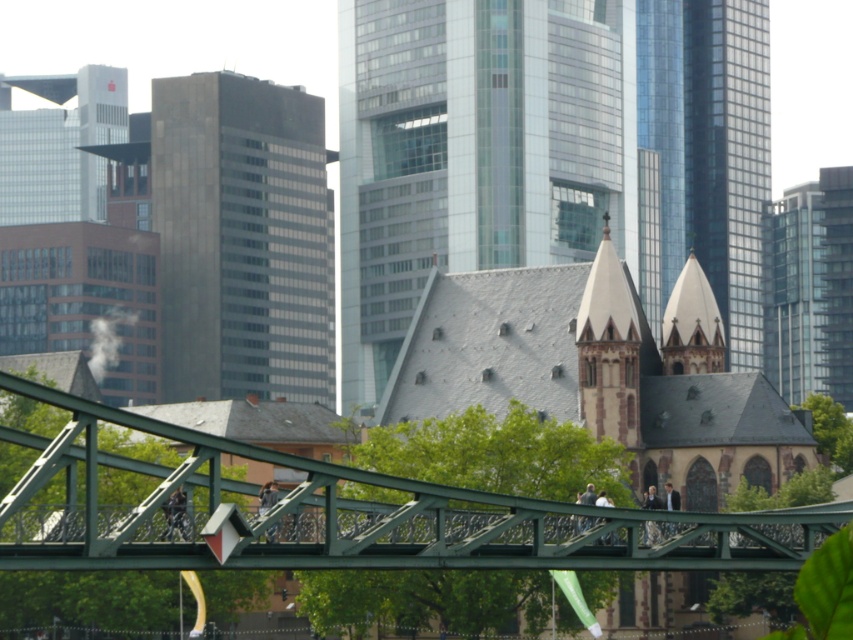
Question: Considering the real-world distances, which object is closest to the dark gray glass building at center?

Choices:
 (A) matte glass tower at upper left
 (B) gray slate roof at center
 (C) glassy reflective skyscraper at upper right

Answer: (B)

Question: Which of the following is the closest to the observer?

Choices:
 (A) (383, 308)
 (B) (697, 212)
 (C) (776, 276)

Answer: (A)

Question: Is green metallic bridge at lower center smaller than shiny glass tower at upper right?

Choices:
 (A) yes
 (B) no

Answer: (A)

Question: From the image, what is the correct spatial relationship of shiny glass tower at upper right in relation to matte glass tower at upper left?

Choices:
 (A) right
 (B) left

Answer: (A)

Question: Which object is the farthest from the green metallic bridge at lower center?

Choices:
 (A) dark gray glass building at center
 (B) matte glass tower at upper left
 (C) shiny glass tower at upper right

Answer: (B)

Question: Does gray slate roof at center appear on the left side of matte glass tower at upper left?

Choices:
 (A) no
 (B) yes

Answer: (A)